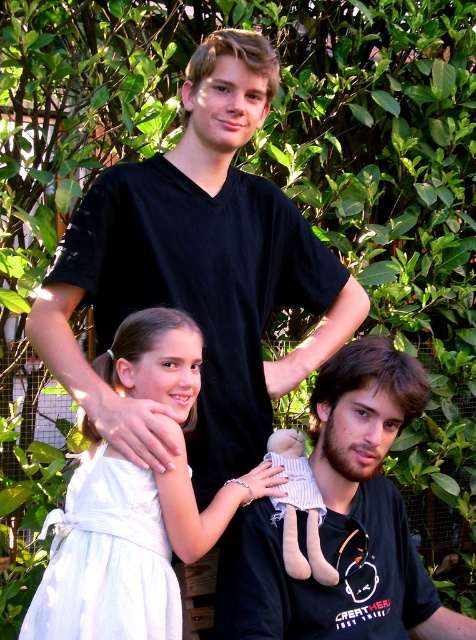
Between matte black shirt at center and white cotton dress at center, which one appears on the left side from the viewer's perspective?

Positioned to the left is white cotton dress at center.

Between point (357, 488) and point (180, 522), which one is positioned behind?

The point (357, 488) is behind.

Locate an element on the screen. matte black shirt at center is located at coordinates (341, 522).

Identify the location of matte black shirt at center. The height and width of the screenshot is (640, 476). (341, 522).

Between white cotton dress at center and soft beige fabric doll at lower center, which one is positioned higher?

white cotton dress at center

Which is below, white cotton dress at center or soft beige fabric doll at lower center?

Positioned lower is soft beige fabric doll at lower center.

Where is `white cotton dress at center`? This screenshot has height=640, width=476. white cotton dress at center is located at coordinates (134, 502).

The width and height of the screenshot is (476, 640). What are the coordinates of `white cotton dress at center` in the screenshot? It's located at (134, 502).

Between matte black shirt at center and soft beige fabric doll at lower center, which one is positioned lower?

soft beige fabric doll at lower center

Where is `matte black shirt at center`? The height and width of the screenshot is (640, 476). matte black shirt at center is located at coordinates (341, 522).

Where is `matte black shirt at center`? The image size is (476, 640). matte black shirt at center is located at coordinates (341, 522).